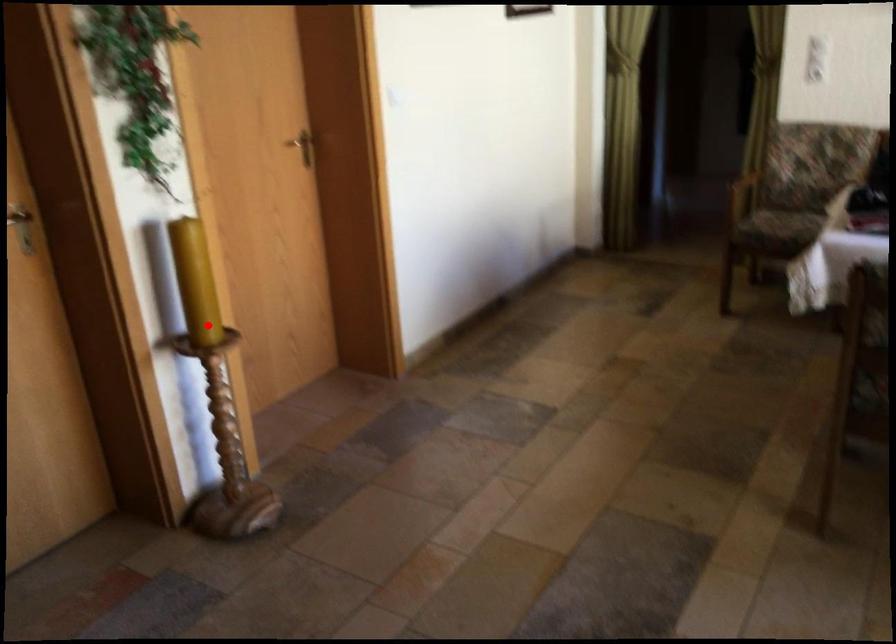
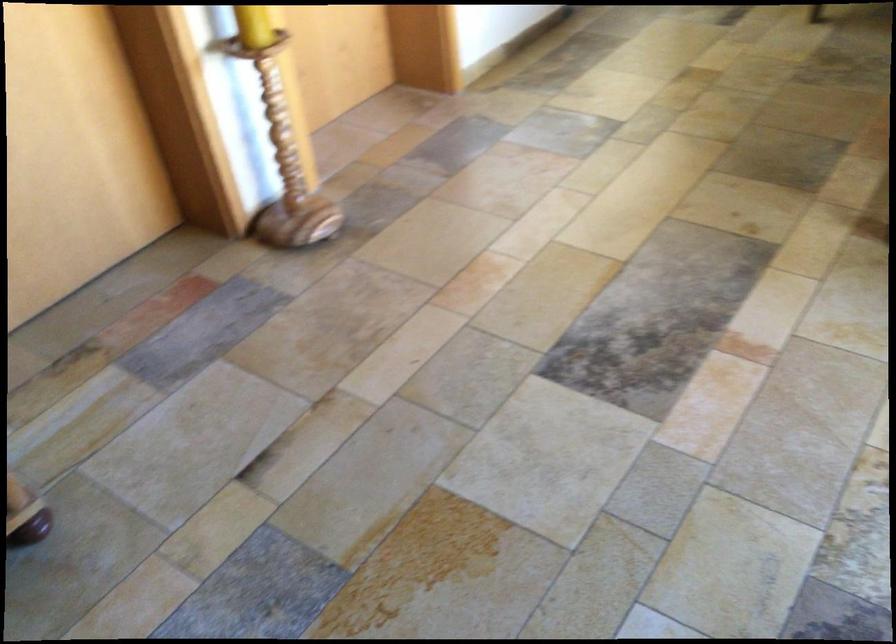
The point at the highlighted location is marked in the first image. Where is the corresponding point in the second image?

(254, 26)